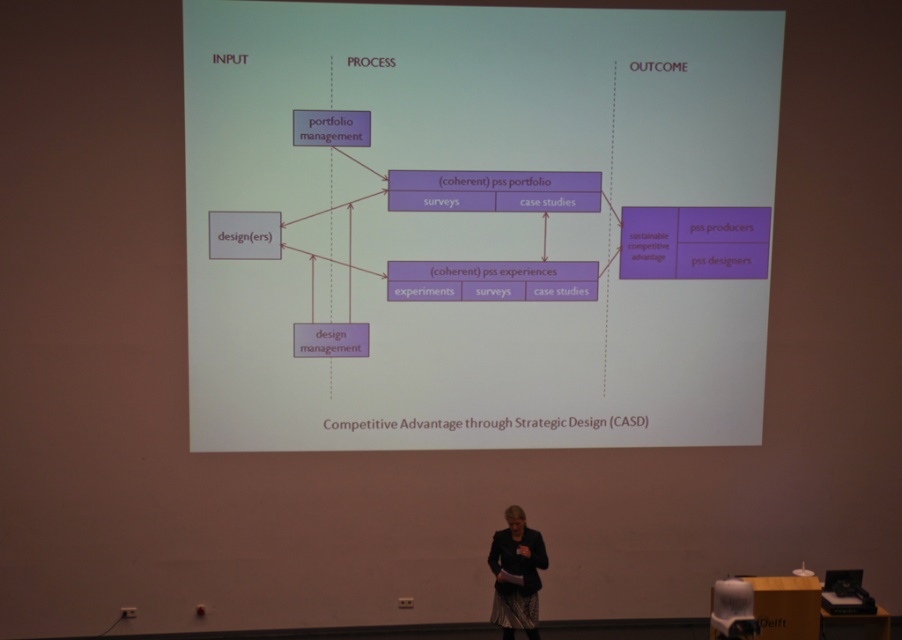
Who is positioned more to the right, purple matte diagram at center or dark gray fabric jacket at lower center?

dark gray fabric jacket at lower center is more to the right.

Is point (261, 72) closer to viewer compared to point (514, 588)?

No, it is behind (514, 588).

The height and width of the screenshot is (640, 902). In order to click on purple matte diagram at center in this screenshot , I will do `click(476, 225)`.